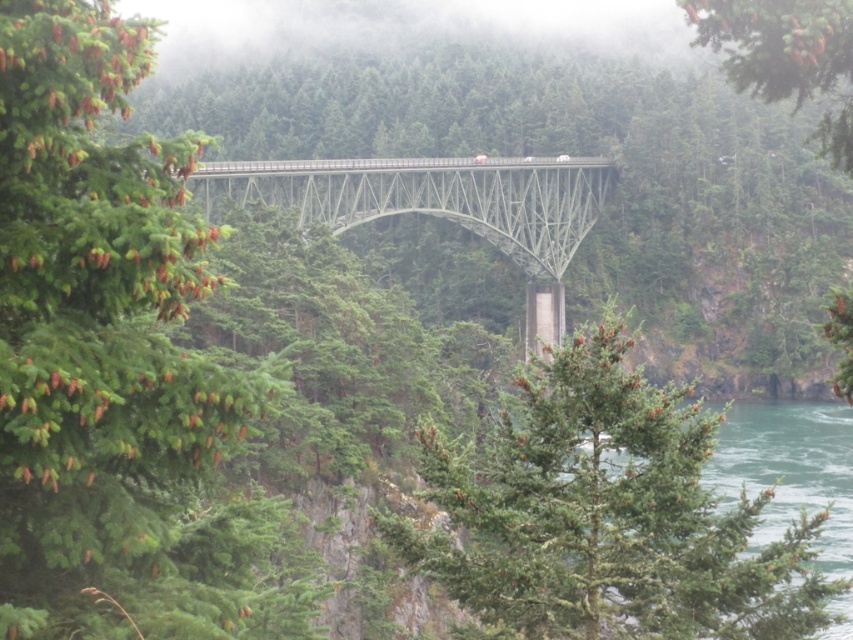
You are a hiker standing on the bridge and looking at the green matte tree at upper left and the green matte tree at center. Which tree appears taller from your perspective?

The green matte tree at upper left appears taller than the green matte tree at center because it is much taller according to the description.

You are a hiker standing on the bridge and looking towards the green matte tree at center and the green matte tree at upper center. Which tree is closer to you?

The green matte tree at center is closer to you because it is positioned in front of the green matte tree at upper center.